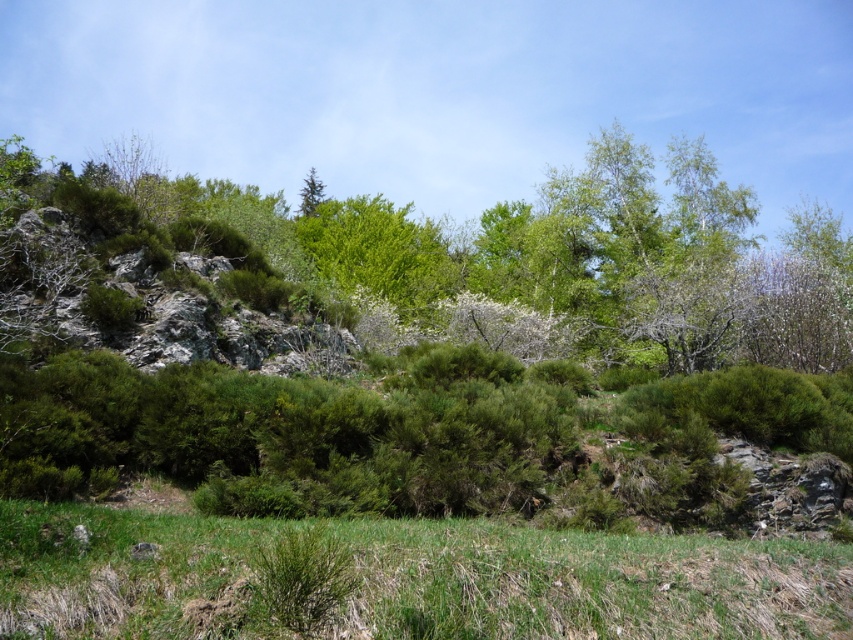
Question: In this image, where is green leafy tree at upper center located relative to green matte tree at upper center?

Choices:
 (A) left
 (B) right

Answer: (A)

Question: Is the position of green grassy at lower center more distant than that of green matte tree at upper center?

Choices:
 (A) no
 (B) yes

Answer: (A)

Question: Is green leafy tree at upper center to the right of green matte tree at upper center from the viewer's perspective?

Choices:
 (A) yes
 (B) no

Answer: (B)

Question: Which of the following is the closest to the observer?

Choices:
 (A) green grassy at lower center
 (B) green matte tree at upper center
 (C) green leafy tree at upper center

Answer: (A)

Question: Which object is positioned closest to the green grassy at lower center?

Choices:
 (A) green leafy tree at upper center
 (B) green matte tree at upper center

Answer: (A)

Question: Among these objects, which one is nearest to the camera?

Choices:
 (A) green leafy tree at upper center
 (B) green matte tree at upper center

Answer: (A)